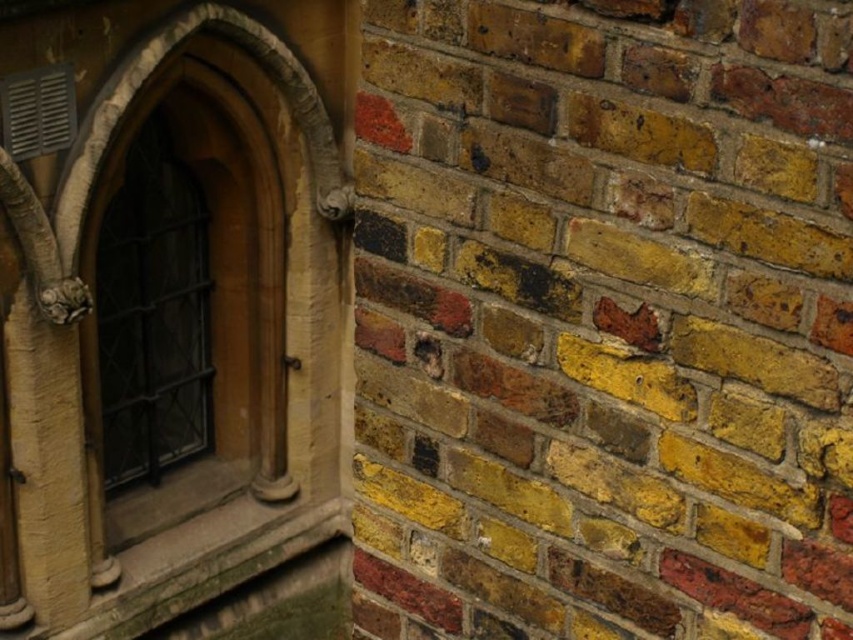
Does point (752, 76) come in front of point (207, 342)?

Yes, point (752, 76) is in front of point (207, 342).

Does yellow brick wall at center appear on the left side of dark brown wooden window at left?

No, yellow brick wall at center is not to the left of dark brown wooden window at left.

Find the location of a particular element. The height and width of the screenshot is (640, 853). yellow brick wall at center is located at coordinates (602, 321).

At what (x,y) coordinates should I click in order to perform the action: click on yellow brick wall at center. Please return your answer as a coordinate pair (x, y). Looking at the image, I should click on (602, 321).